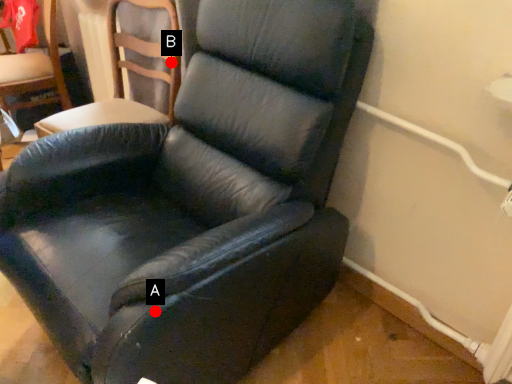
Question: Two points are circled on the image, labeled by A and B beside each circle. Which point is closer to the camera?

Choices:
 (A) A is closer
 (B) B is closer

Answer: (A)